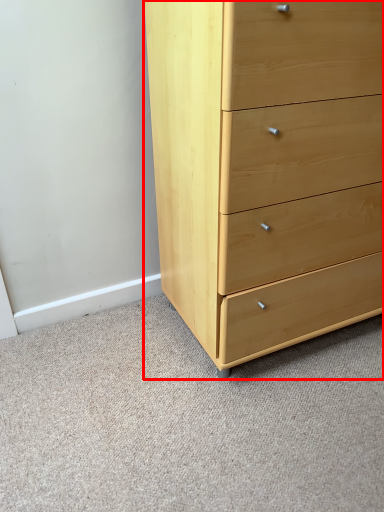
Question: From the image's perspective, considering the relative positions of chest of drawers (annotated by the red box) and plain in the image provided, where is chest of drawers (annotated by the red box) located with respect to the staircase?

Choices:
 (A) above
 (B) below

Answer: (A)